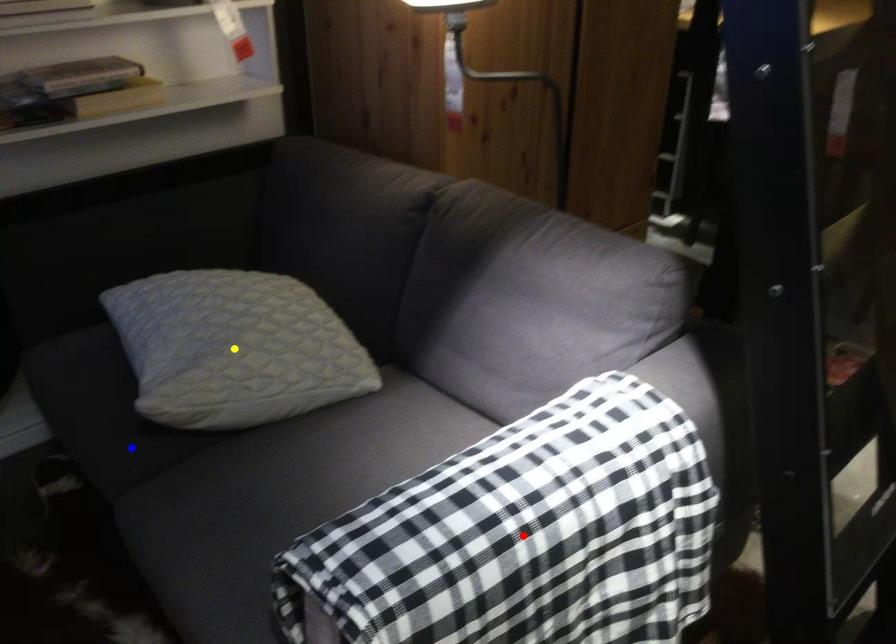
Looking at this image, order these from farthest to nearest:
blue point, yellow point, red point

1. blue point
2. yellow point
3. red point